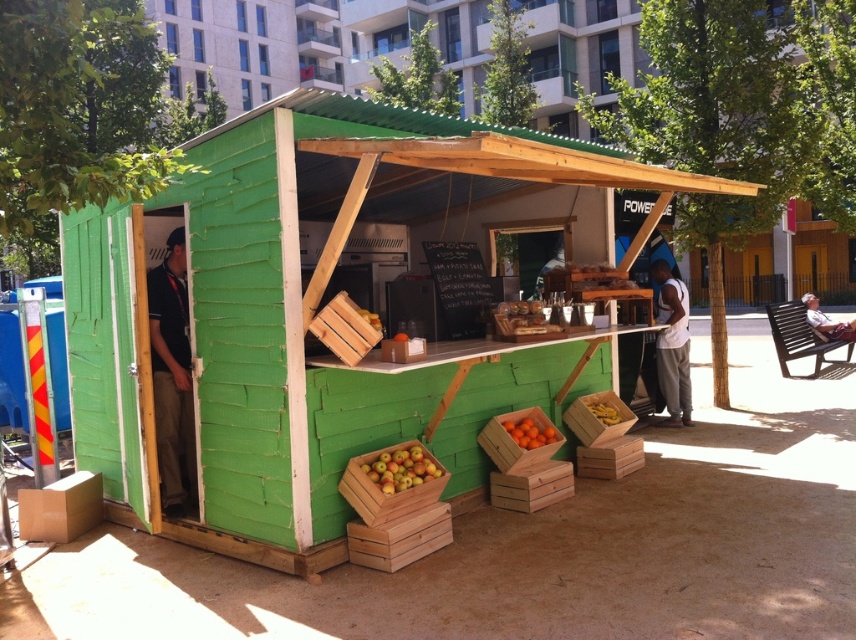
Is red matte apples at lower left taller than orange matte wooden crate at lower center?

Yes.

Where is `red matte apples at lower left`? The width and height of the screenshot is (856, 640). red matte apples at lower left is located at coordinates (401, 468).

Is the position of white cotton tank top at right more distant than that of red matte apples at lower left?

Yes, it is.

Is point (658, 422) positioned behind point (409, 464)?

Yes, it is.

Locate an element on the screen. white cotton tank top at right is located at coordinates (672, 346).

Is light brown wooden bench at lower right positioned behind wooden crate at center?

Yes, light brown wooden bench at lower right is behind wooden crate at center.

Between light brown wooden bench at lower right and wooden crate at center, which one is positioned higher?

wooden crate at center

At what (x,y) coordinates should I click in order to perform the action: click on light brown wooden bench at lower right. Please return your answer as a coordinate pair (x, y). The image size is (856, 640). Looking at the image, I should click on (825, 321).